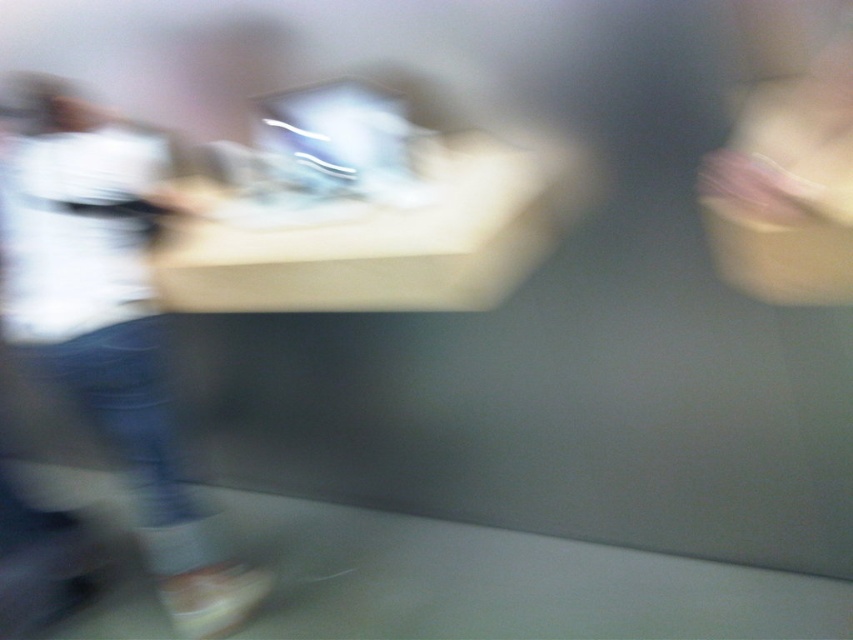
Question: Observing the image, what is the correct spatial positioning of blue jeans at left in reference to matte plastic computer at center?

Choices:
 (A) left
 (B) right

Answer: (A)

Question: Can you confirm if blue jeans at left is bigger than matte plastic computer at center?

Choices:
 (A) no
 (B) yes

Answer: (B)

Question: Does blue jeans at left have a greater width compared to matte plastic computer at center?

Choices:
 (A) yes
 (B) no

Answer: (A)